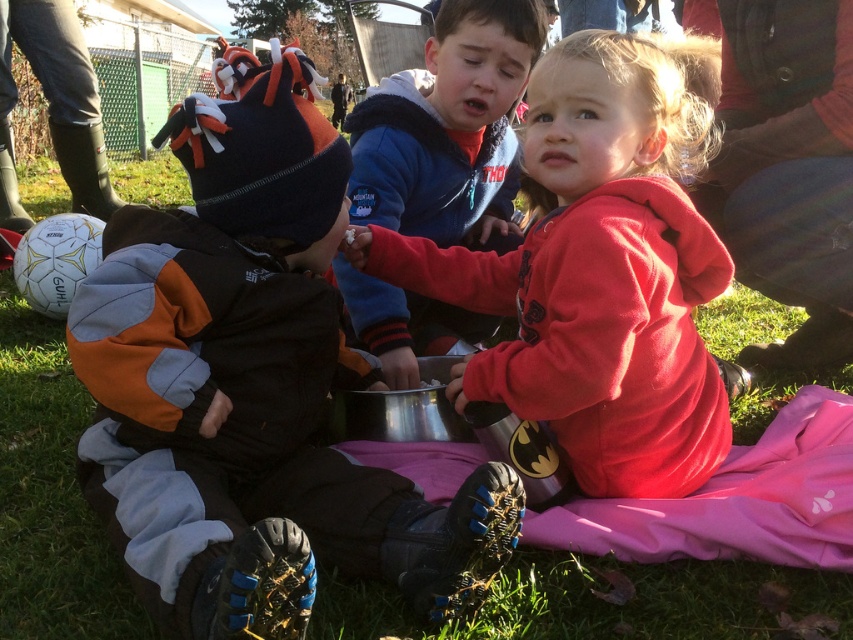
You are a photographer trying to capture a group photo of the orange fleece jacket at center and the blue fleece jacket at center. The camera you are using has a minimum focus distance of 60 centimeters. Will you be able to take a clear photo of both jackets at the same time?

The orange fleece jacket at center and blue fleece jacket at center are 58.13 centimeters apart, which is less than the camera minimum focus distance of 60 centimeters. Therefore, you won not be able to take a clear photo of both jackets at the same time.

Based on the photo, in the scene described, there are two children wearing fleece jackets at the center. The orange fleece jacket at center and the blue fleece jacket at center. From the perspective of someone facing the scene, which jacket is positioned to the left?

The orange fleece jacket at center is positioned to the left of the blue fleece jacket at center.